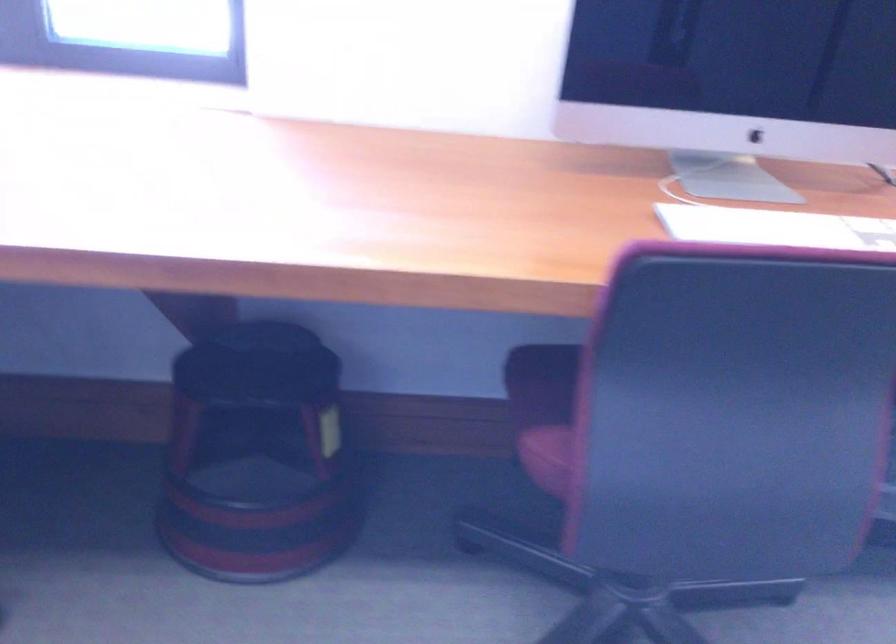
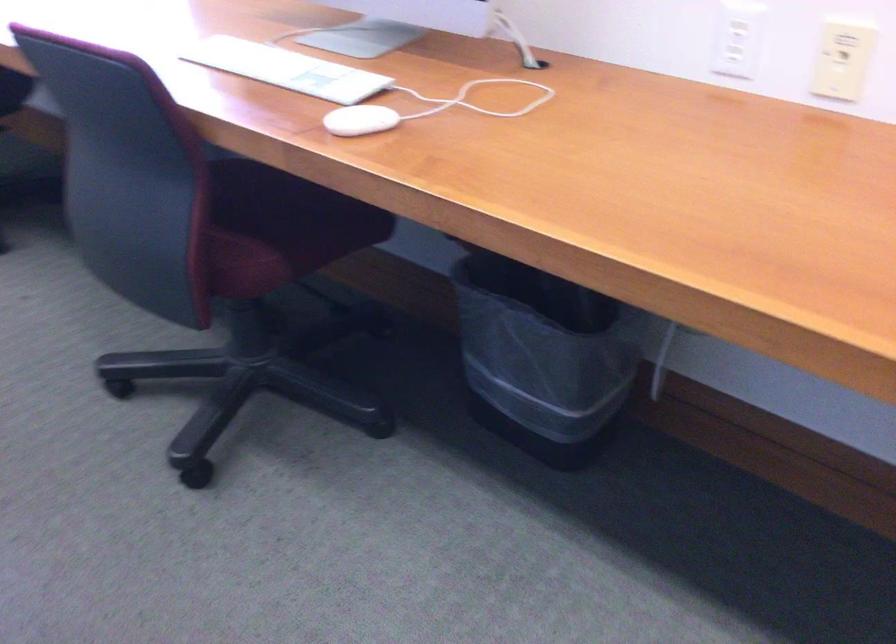
Find the pixel in the second image that matches the point at 821,225 in the first image.

(286, 69)